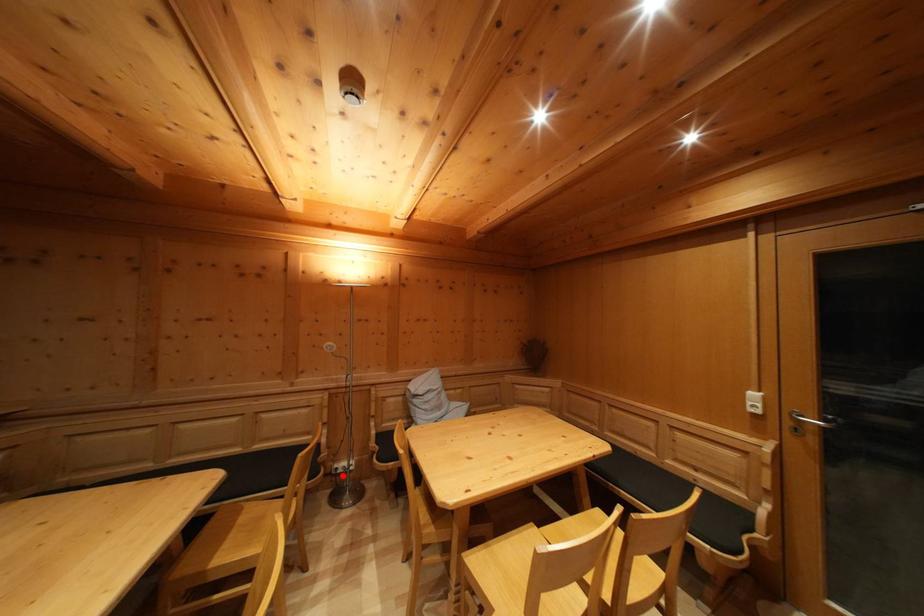
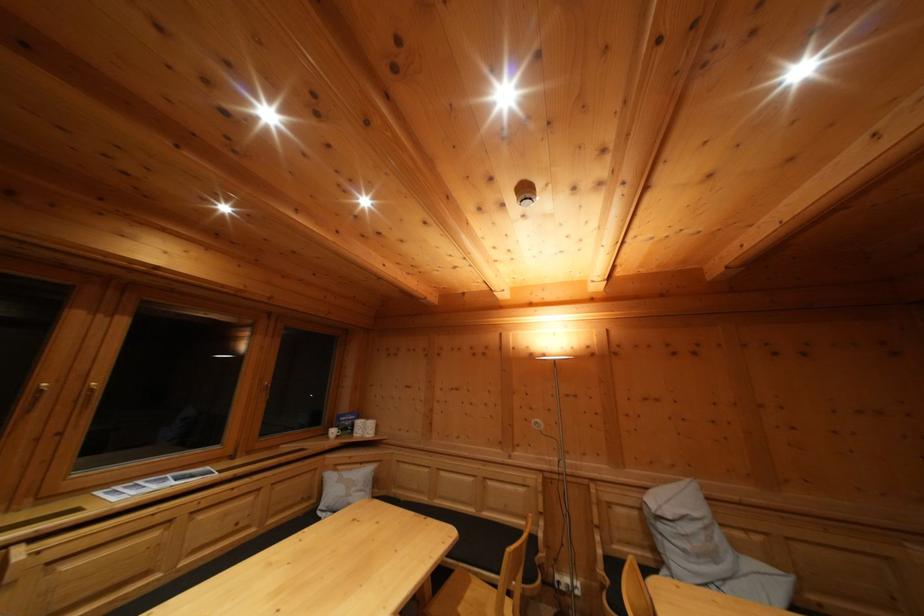
Question: I am providing you with two images of the same scene from different viewpoints. Image1 has a red point marked. In image2, the corresponding 3D location appears at what relative position? Reply with the corresponding letter.

Choices:
 (A) Closer
 (B) Farther

Answer: (A)